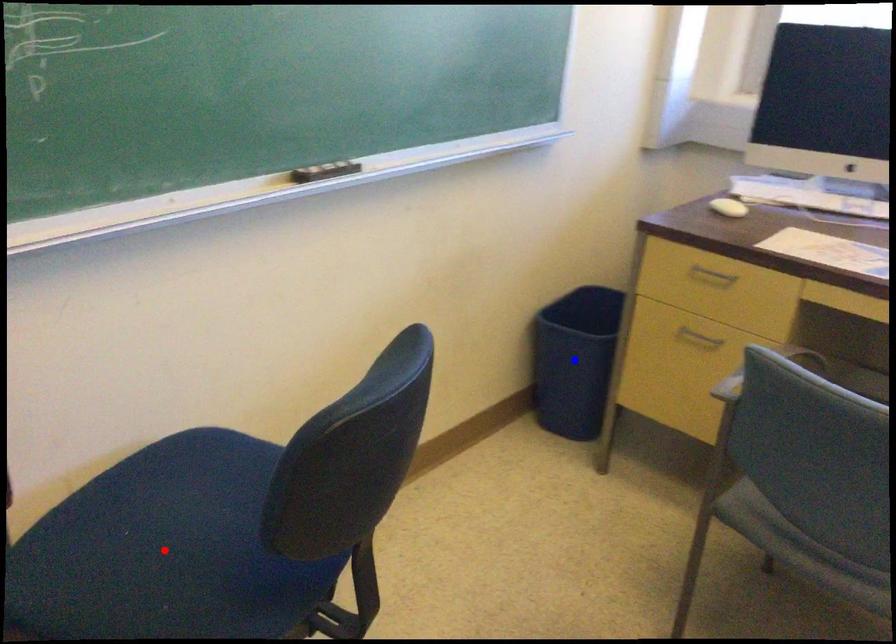
Question: Two points are marked on the image. Which point is closer to the camera?

Choices:
 (A) Blue point is closer.
 (B) Red point is closer.

Answer: (B)